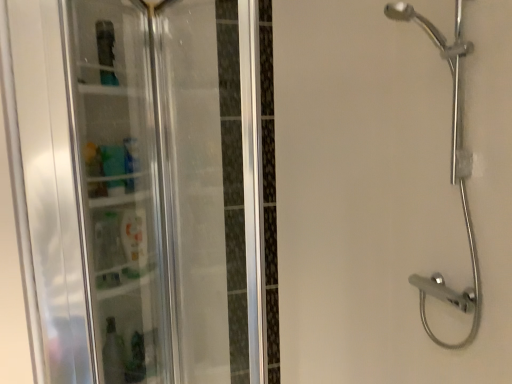
Question: Considering the relative sizes of chrome metallic shower head at right and transparent plastic shelf at left in the image provided, is chrome metallic shower head at right smaller than transparent plastic shelf at left?

Choices:
 (A) no
 (B) yes

Answer: (A)

Question: From a real-world perspective, is chrome metallic shower head at right on transparent plastic shelf at left?

Choices:
 (A) no
 (B) yes

Answer: (B)

Question: From the image's perspective, is chrome metallic shower head at right beneath transparent plastic shelf at left?

Choices:
 (A) yes
 (B) no

Answer: (B)

Question: Can you confirm if chrome metallic shower head at right is thinner than transparent plastic shelf at left?

Choices:
 (A) no
 (B) yes

Answer: (B)

Question: Does chrome metallic shower head at right come behind transparent plastic shelf at left?

Choices:
 (A) yes
 (B) no

Answer: (A)

Question: Is chrome metallic shower head at right bigger than transparent plastic shelf at left?

Choices:
 (A) yes
 (B) no

Answer: (A)

Question: Is transparent plastic shelf at left aimed at chrome metallic shower head at right?

Choices:
 (A) no
 (B) yes

Answer: (A)

Question: Considering the relative sizes of transparent plastic shelf at left and chrome metallic shower head at right in the image provided, is transparent plastic shelf at left shorter than chrome metallic shower head at right?

Choices:
 (A) yes
 (B) no

Answer: (A)

Question: Is transparent plastic shelf at left further to the viewer compared to chrome metallic shower head at right?

Choices:
 (A) no
 (B) yes

Answer: (A)

Question: Is transparent plastic shelf at left taller than chrome metallic shower head at right?

Choices:
 (A) yes
 (B) no

Answer: (B)

Question: Can you confirm if transparent plastic shelf at left is positioned to the left of chrome metallic shower head at right?

Choices:
 (A) yes
 (B) no

Answer: (A)

Question: Considering the relative positions of transparent plastic shelf at left and chrome metallic shower head at right in the image provided, is transparent plastic shelf at left in front of chrome metallic shower head at right?

Choices:
 (A) yes
 (B) no

Answer: (A)

Question: From a real-world perspective, is chrome metallic shower head at right positioned above or below transparent plastic shelf at left?

Choices:
 (A) above
 (B) below

Answer: (A)